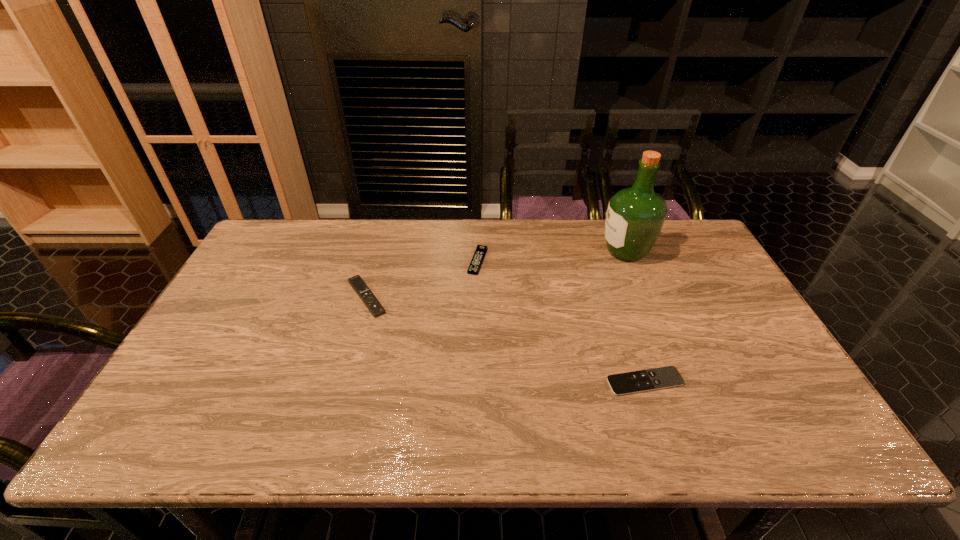
Find the location of a particular element. The height and width of the screenshot is (540, 960). the tallest object is located at coordinates (635, 216).

What are the coordinates of `the second nearest remote control` in the screenshot? It's located at (357, 283).

Where is `the tallest remote control`? This screenshot has height=540, width=960. the tallest remote control is located at coordinates (357, 283).

The width and height of the screenshot is (960, 540). Find the location of `the second shortest remote control`. the second shortest remote control is located at coordinates (475, 264).

Find the location of a particular element. This screenshot has width=960, height=540. the second shortest object is located at coordinates (475, 264).

At what (x,y) coordinates should I click in order to perform the action: click on the shortest remote control. Please return your answer as a coordinate pair (x, y). Looking at the image, I should click on (663, 377).

Locate an element on the screen. The image size is (960, 540). the nearest remote control is located at coordinates (663, 377).

The image size is (960, 540). In order to click on free point located 0.140m on the front-facing side of the tallest object in this screenshot , I will do `click(558, 251)`.

Locate an element on the screen. The height and width of the screenshot is (540, 960). free location located 0.060m on the front-facing side of the tallest object is located at coordinates click(x=582, y=251).

At what (x,y) coordinates should I click in order to perform the action: click on free space located 0.290m on the front-facing side of the tallest object. Please return your answer as a coordinate pair (x, y). The width and height of the screenshot is (960, 540). Looking at the image, I should click on (514, 251).